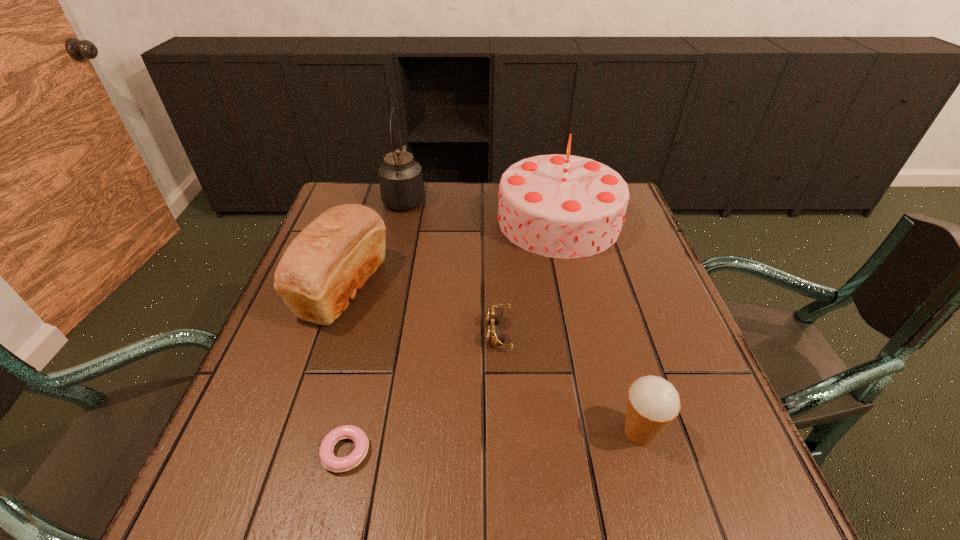
I want to click on vacant area that lies between the icecream and the birthday cake, so click(x=599, y=326).

This screenshot has width=960, height=540. In order to click on free space between the bread and the fourth tallest object in this screenshot , I will do `click(492, 360)`.

Find the location of a particular element. vacant region between the shortest object and the third tallest object is located at coordinates coord(345,369).

Where is `free point between the shortest object and the goggles`? free point between the shortest object and the goggles is located at coordinates (422, 392).

Where is `free space between the doughnut and the birthday cake`? The image size is (960, 540). free space between the doughnut and the birthday cake is located at coordinates (452, 336).

At what (x,y) coordinates should I click in order to perform the action: click on free space between the doughnut and the goggles. Please return your answer as a coordinate pair (x, y). Looking at the image, I should click on tap(422, 392).

The image size is (960, 540). In order to click on unoccupied position between the icecream and the birthday cake in this screenshot , I will do `click(599, 326)`.

What are the coordinates of `free space between the fifth tallest object and the fourth shortest object` in the screenshot? It's located at (420, 310).

Locate an element on the screen. object that stands as the fourth closest to the birthday cake is located at coordinates (653, 403).

What are the coordinates of `object that is the fourth closest to the third shortest object` in the screenshot? It's located at (331, 259).